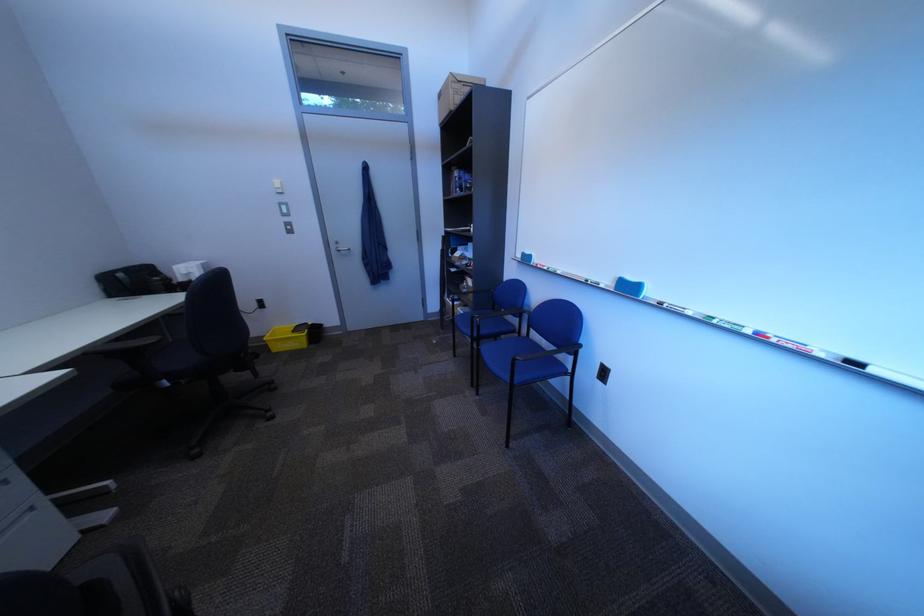
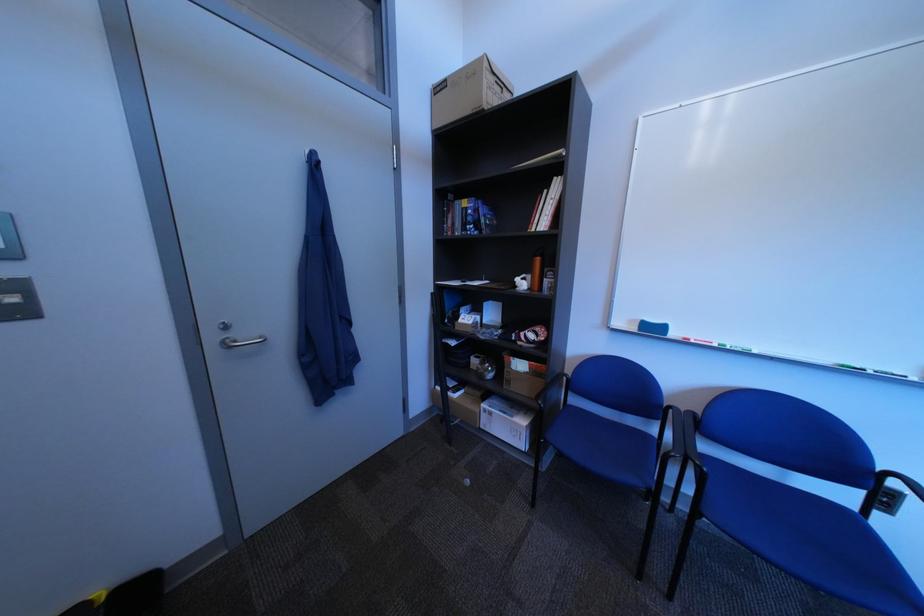
The point at (561, 270) is marked in the first image. Where is the corresponding point in the second image?

(732, 347)